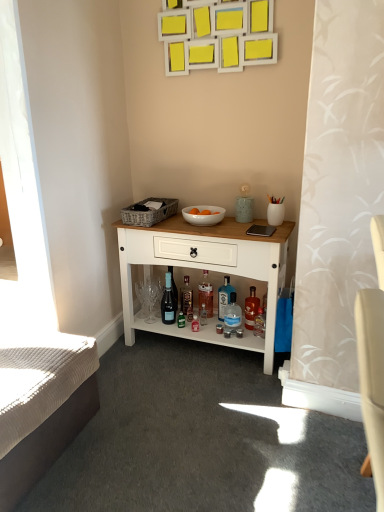
Question: Is matte glass wine bottle at center aimed at white wood cabinet at center?

Choices:
 (A) yes
 (B) no

Answer: (A)

Question: Is matte glass wine bottle at center outside white wood cabinet at center?

Choices:
 (A) yes
 (B) no

Answer: (B)

Question: Does matte glass wine bottle at center contain white wood cabinet at center?

Choices:
 (A) no
 (B) yes

Answer: (A)

Question: From the image's perspective, does matte glass wine bottle at center appear higher than white wood cabinet at center?

Choices:
 (A) yes
 (B) no

Answer: (B)

Question: Does matte glass wine bottle at center have a smaller size compared to white wood cabinet at center?

Choices:
 (A) yes
 (B) no

Answer: (A)

Question: Is matte glass wine bottle at center not close to white wood cabinet at center?

Choices:
 (A) yes
 (B) no

Answer: (B)

Question: From the image's perspective, is translucent glass bottle at center, which is the fifth bottle from right to left, under transparent glass bottle at center, which is counted as the second bottle, starting from the right?

Choices:
 (A) no
 (B) yes

Answer: (A)

Question: Is translucent glass bottle at center, which is the fifth bottle from right to left, positioned beyond the bounds of transparent glass bottle at center, which is counted as the second bottle, starting from the right?

Choices:
 (A) no
 (B) yes

Answer: (B)

Question: Can you confirm if translucent glass bottle at center, which appears as the first bottle when viewed from the left, is thinner than transparent glass bottle at center, which is counted as the second bottle, starting from the right?

Choices:
 (A) no
 (B) yes

Answer: (A)

Question: Can you confirm if translucent glass bottle at center, which is the fifth bottle from right to left, is bigger than transparent glass bottle at center, which is counted as the second bottle, starting from the right?

Choices:
 (A) yes
 (B) no

Answer: (B)

Question: Can you see translucent glass bottle at center, which is the fifth bottle from right to left, touching transparent glass bottle at center, which is counted as the second bottle, starting from the right?

Choices:
 (A) yes
 (B) no

Answer: (B)

Question: Does translucent glass bottle at center, which is the fifth bottle from right to left, have a greater height compared to transparent glass bottle at center, which is counted as the second bottle, starting from the right?

Choices:
 (A) yes
 (B) no

Answer: (A)

Question: Is white glossy bowl at center beside white textured mattress at lower left?

Choices:
 (A) yes
 (B) no

Answer: (B)